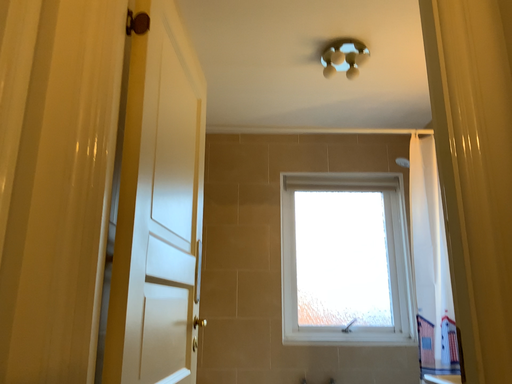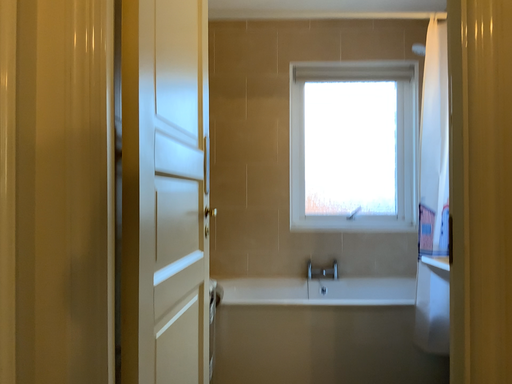
Question: Which way did the camera rotate in the video?

Choices:
 (A) rotated upward
 (B) rotated downward

Answer: (B)